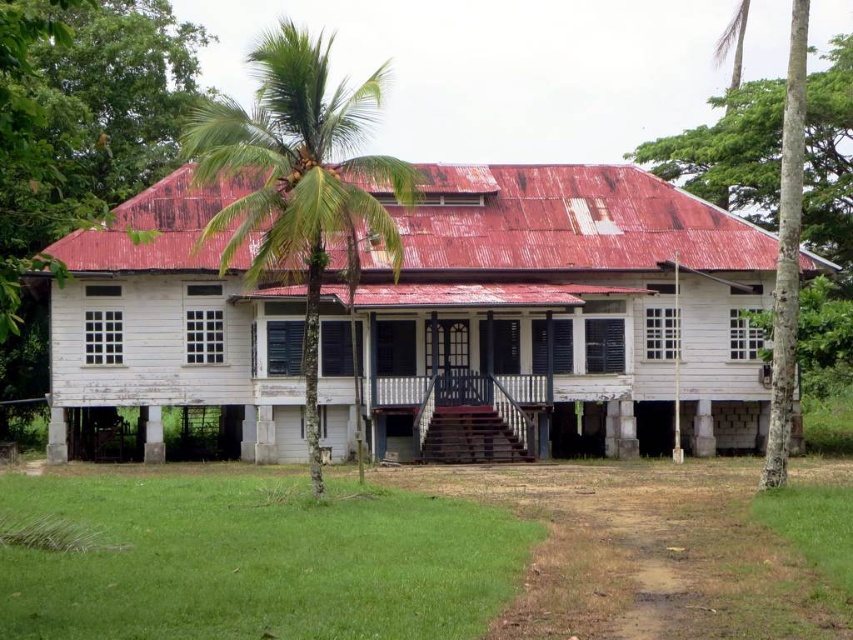
Question: Does white wooden house at center come behind green leafy palm tree at center?

Choices:
 (A) no
 (B) yes

Answer: (B)

Question: Which point is farther to the camera?

Choices:
 (A) smooth bark palm tree at right
 (B) green leafy palm tree at center
 (C) white wooden house at center

Answer: (C)

Question: Which is farther from the green leafy palm tree at center?

Choices:
 (A) white wooden house at center
 (B) smooth bark palm tree at right

Answer: (B)

Question: Considering the relative positions of green leafy palm tree at center and smooth bark palm tree at right in the image provided, where is green leafy palm tree at center located with respect to smooth bark palm tree at right?

Choices:
 (A) left
 (B) right

Answer: (A)

Question: Which object is farther from the camera taking this photo?

Choices:
 (A) green leafy palm tree at center
 (B) smooth bark palm tree at right

Answer: (B)

Question: Is white wooden house at center wider than green leafy palm tree at center?

Choices:
 (A) yes
 (B) no

Answer: (A)